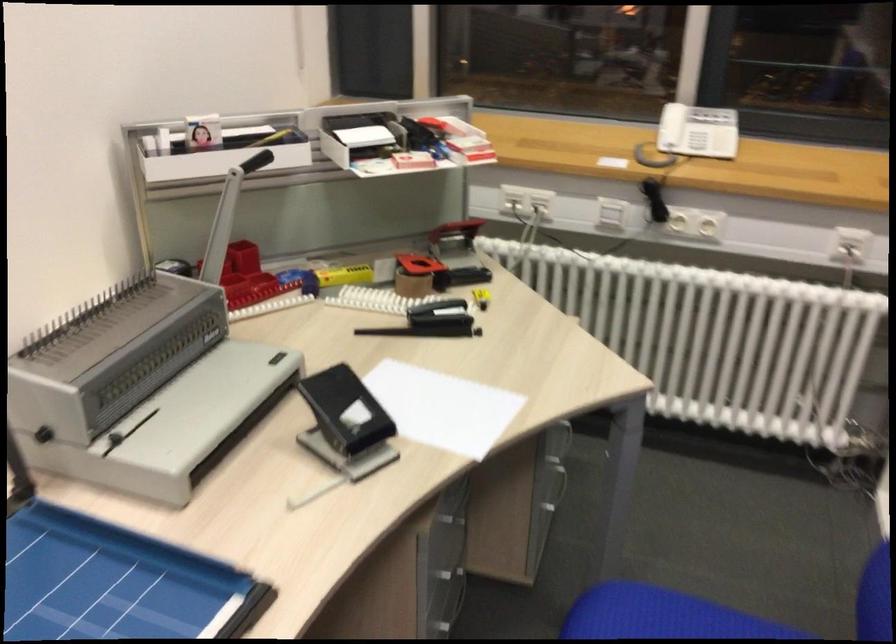
What do you see at coordinates (686, 144) in the screenshot?
I see `a telephone handset` at bounding box center [686, 144].